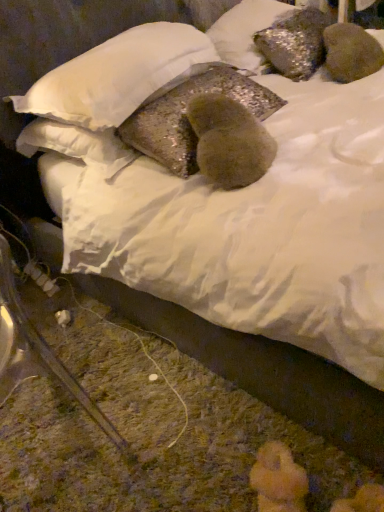
Question: Is shiny metallic pillow at center, the 2th pillow when ordered from top to bottom, facing towards glittery fabric pillow at center, the 3th pillow in the top-to-bottom sequence?

Choices:
 (A) yes
 (B) no

Answer: (B)

Question: Is shiny metallic pillow at center, which is the second pillow from bottom to top, bigger than glittery fabric pillow at center, the 3th pillow in the top-to-bottom sequence?

Choices:
 (A) no
 (B) yes

Answer: (B)

Question: Does shiny metallic pillow at center, the 2th pillow when ordered from top to bottom, lie behind glittery fabric pillow at center, marked as the first pillow in a bottom-to-top arrangement?

Choices:
 (A) yes
 (B) no

Answer: (B)

Question: Considering the relative sizes of shiny metallic pillow at center, the 2th pillow when ordered from top to bottom, and glittery fabric pillow at center, marked as the first pillow in a bottom-to-top arrangement, in the image provided, is shiny metallic pillow at center, the 2th pillow when ordered from top to bottom, thinner than glittery fabric pillow at center, marked as the first pillow in a bottom-to-top arrangement,?

Choices:
 (A) yes
 (B) no

Answer: (B)

Question: Can you confirm if shiny metallic pillow at center, which is the second pillow from bottom to top, is positioned to the left of glittery fabric pillow at center, the 3th pillow in the top-to-bottom sequence?

Choices:
 (A) no
 (B) yes

Answer: (B)

Question: In terms of height, does glittery fabric pillow at center, the 3th pillow in the top-to-bottom sequence, look taller or shorter compared to shiny metallic pillow at center, which is the second pillow from bottom to top?

Choices:
 (A) tall
 (B) short

Answer: (A)

Question: Is glittery fabric pillow at center, the 3th pillow in the top-to-bottom sequence, in front of or behind shiny metallic pillow at center, the 2th pillow when ordered from top to bottom, in the image?

Choices:
 (A) front
 (B) behind

Answer: (B)

Question: From a real-world perspective, is glittery fabric pillow at center, marked as the first pillow in a bottom-to-top arrangement, positioned above or below shiny metallic pillow at center, which is the second pillow from bottom to top?

Choices:
 (A) below
 (B) above

Answer: (A)

Question: From the image's perspective, is glittery fabric pillow at center, marked as the first pillow in a bottom-to-top arrangement, located above or below shiny metallic pillow at center, the 2th pillow when ordered from top to bottom?

Choices:
 (A) below
 (B) above

Answer: (A)

Question: From a real-world perspective, is sparkly metallic pillow at upper center, the 3th pillow positioned from the bottom, physically located above or below glittery fabric pillow at center, the 3th pillow in the top-to-bottom sequence?

Choices:
 (A) above
 (B) below

Answer: (A)

Question: From the image's perspective, is sparkly metallic pillow at upper center, which is counted as the 1th pillow, starting from the top, positioned above or below glittery fabric pillow at center, marked as the first pillow in a bottom-to-top arrangement?

Choices:
 (A) below
 (B) above

Answer: (B)

Question: Considering the relative positions of sparkly metallic pillow at upper center, the 3th pillow positioned from the bottom, and glittery fabric pillow at center, marked as the first pillow in a bottom-to-top arrangement, in the image provided, is sparkly metallic pillow at upper center, the 3th pillow positioned from the bottom, to the left or to the right of glittery fabric pillow at center, marked as the first pillow in a bottom-to-top arrangement,?

Choices:
 (A) left
 (B) right

Answer: (B)

Question: Is point (283, 3) closer or farther from the camera than point (162, 132)?

Choices:
 (A) closer
 (B) farther

Answer: (B)

Question: Would you say glittery fabric pillow at center, the 3th pillow in the top-to-bottom sequence, is to the left or to the right of sparkly metallic pillow at upper center, the 3th pillow positioned from the bottom, in the picture?

Choices:
 (A) left
 (B) right

Answer: (A)

Question: From a real-world perspective, is glittery fabric pillow at center, the 3th pillow in the top-to-bottom sequence, above or below sparkly metallic pillow at upper center, which is counted as the 1th pillow, starting from the top?

Choices:
 (A) below
 (B) above

Answer: (A)